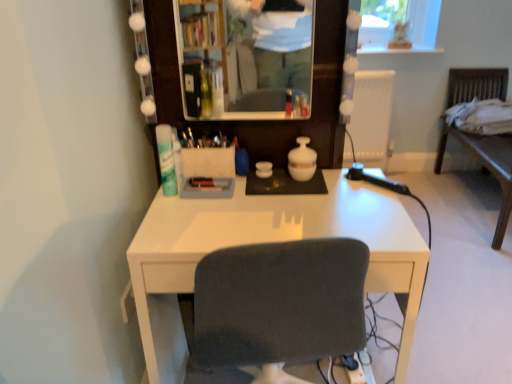
This screenshot has width=512, height=384. Find the location of `vacant region above white plastic radiator at upper right (from a real-world perspective)`. vacant region above white plastic radiator at upper right (from a real-world perspective) is located at coordinates (380, 72).